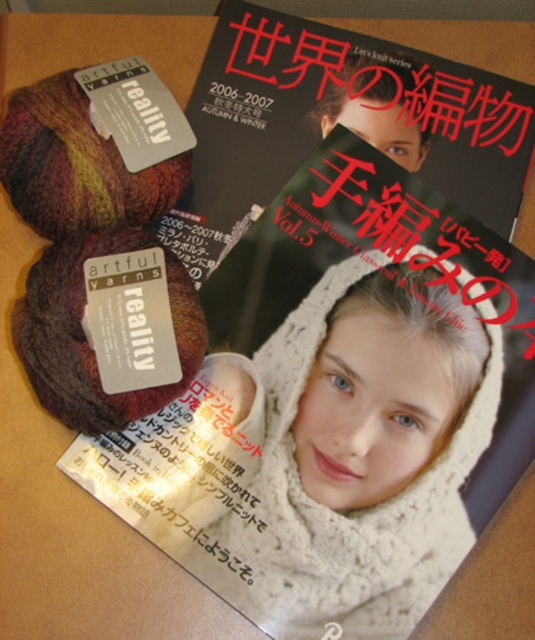
You are organizing a craft fair booth and need to display the white knitted scarf at center and the matte black magazine at upper center. If you want to place them side by side on a shelf, which item should you place on the left to ensure both fit without overlapping?

Since the white knitted scarf at center is larger in size than the matte black magazine at upper center, you should place the smaller matte black magazine at upper center on the left side so that the larger scarf can be positioned to its right without overlapping.

You are a photographer setting up a shot of the white knitted scarf at center. The camera is positioned 26.91 inches away from the scarf. If you want to capture the entire scarf in the frame without moving the camera, what adjustment should you make?

The white knitted scarf at center is 26.91 inches from the camera. To capture the entire scarf without moving the camera, you should adjust the zoom lens to a wider angle.

In the scene shown: You are organizing a craft fair booth and need to arrange items according to spatial guidelines. You have a white knitted scarf at center and a matte black magazine at upper center. According to the scene, which item is positioned to the right of the other?

The white knitted scarf at center is to the right of the matte black magazine at upper center.